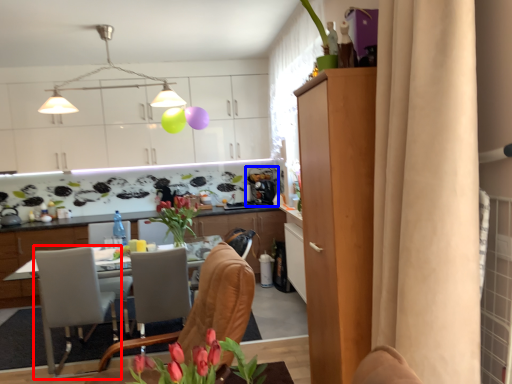
Question: Which point is closer to the camera, chair (highlighted by a red box) or coffee machine (highlighted by a blue box)?

Choices:
 (A) chair
 (B) coffee machine

Answer: (A)